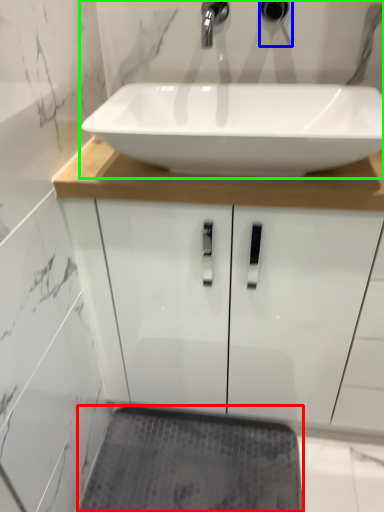
Question: Which object is the closest to the bath mat (highlighted by a red box)? Choose among these: plumbing fixture (highlighted by a blue box) or sink (highlighted by a green box).

Choices:
 (A) plumbing fixture
 (B) sink

Answer: (B)